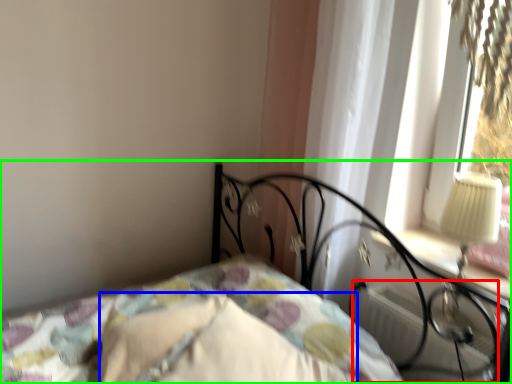
Question: Based on their relative distances, which object is farther from radiator (highlighted by a red box)? Choose from pillow (highlighted by a blue box) and bed (highlighted by a green box).

Choices:
 (A) pillow
 (B) bed

Answer: (A)